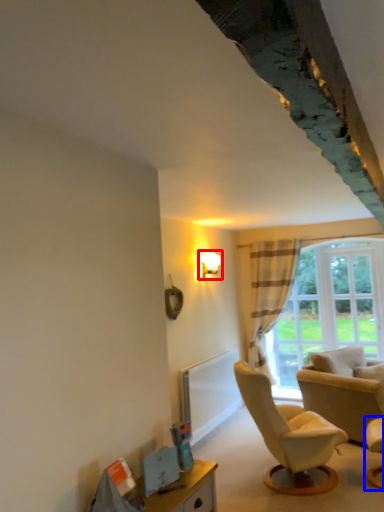
Question: Which point is closer to the camera, light fixture (highlighted by a red box) or chair (highlighted by a blue box)?

Choices:
 (A) light fixture
 (B) chair

Answer: (B)